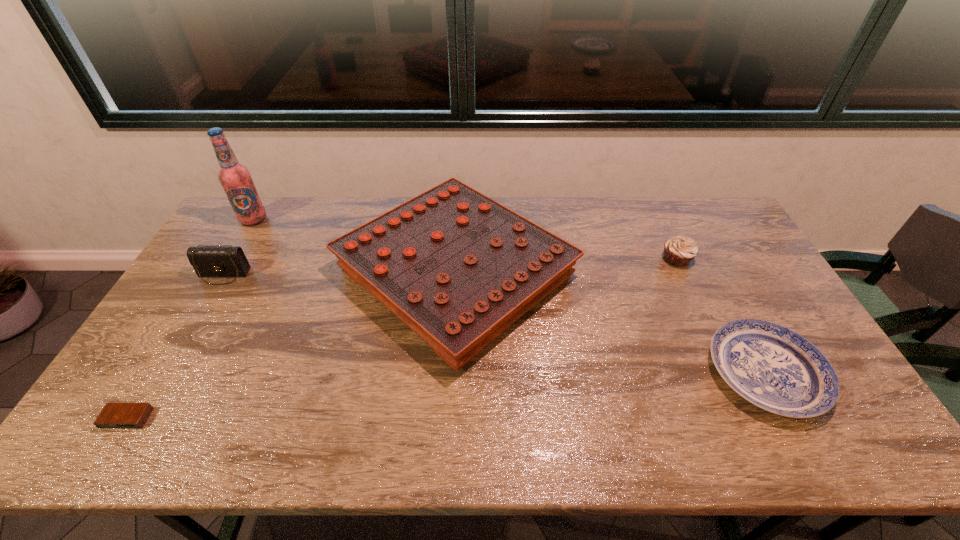
The image size is (960, 540). I want to click on object located at the near left corner, so click(x=114, y=415).

In order to click on object located in the near right corner section of the desktop in this screenshot , I will do `click(771, 366)`.

Identify the location of vacant point at the far edge. (338, 208).

The width and height of the screenshot is (960, 540). Identify the location of vacant position at the near edge of the desktop. (409, 435).

This screenshot has height=540, width=960. Identify the location of vacant area at the left edge of the desktop. (134, 384).

Find the location of a particular element. vacant space at the right edge of the desktop is located at coordinates (790, 315).

Where is `free space at the far right corner of the desktop`? free space at the far right corner of the desktop is located at coordinates (712, 232).

Locate an element on the screen. free space between the gameboard and the shortest object is located at coordinates (291, 346).

The image size is (960, 540). Find the location of `unoccupied area between the shortest object and the alcohol`. unoccupied area between the shortest object and the alcohol is located at coordinates (190, 319).

The width and height of the screenshot is (960, 540). Identify the location of free space between the muffin and the plate. (721, 316).